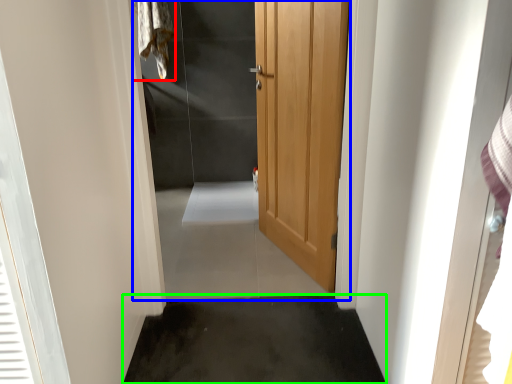
Question: Which is nearer to the laundry (highlighted by a red box)? elevator (highlighted by a blue box) or concrete (highlighted by a green box).

Choices:
 (A) elevator
 (B) concrete

Answer: (A)